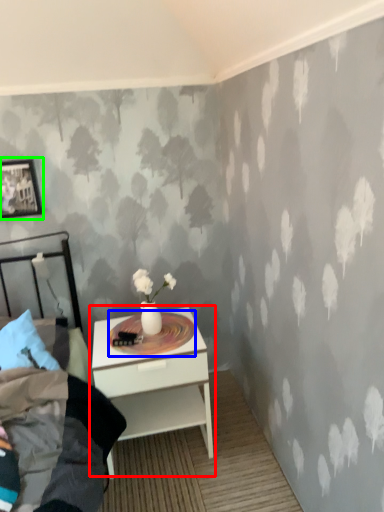
Question: Based on their relative distances, which object is nearer to nightstand (highlighted by a red box)? Choose from round table (highlighted by a blue box) and picture frame (highlighted by a green box).

Choices:
 (A) round table
 (B) picture frame

Answer: (A)